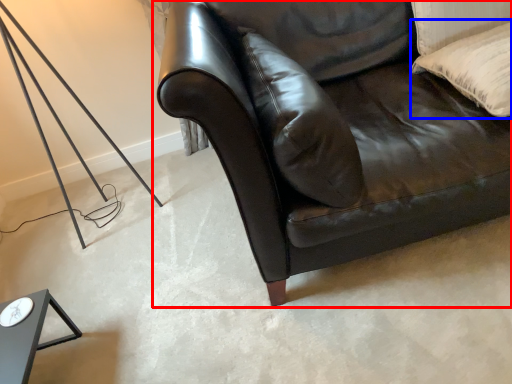
Question: Which of the following is the closest to the observer, studio couch (highlighted by a red box) or pillow (highlighted by a blue box)?

Choices:
 (A) studio couch
 (B) pillow

Answer: (A)